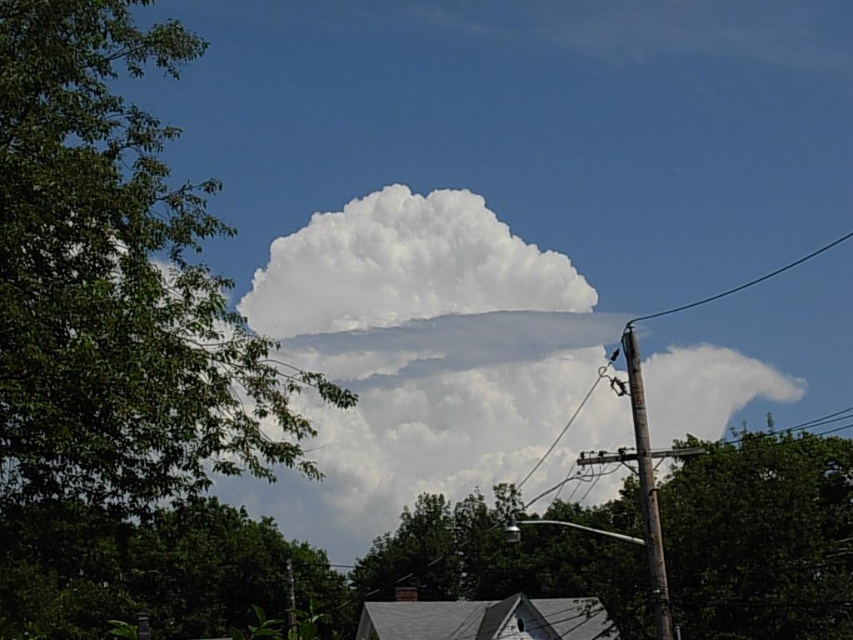
You are standing in a suburban area and see the green leafy tree at center. If you want to take a photo of the tree from a distance of 30 meters, will you need to move closer or farther away?

The green leafy tree at center is currently 26.09 meters away from you. To achieve a distance of 30 meters, you need to move farther away from the tree.

You are a bird flying in the sky and want to land on the green leafy tree at center. Are you able to avoid the black wire at upper right?

The green leafy tree at center is below the black wire at upper right, so yes, the bird can avoid the black wire at upper right by landing on the tree below it.

You are standing in the suburban scene and want to find a specific point marked as point (761, 538). According to the scene description, where is this point located?

The point (761, 538) is on the green leafy tree at center.